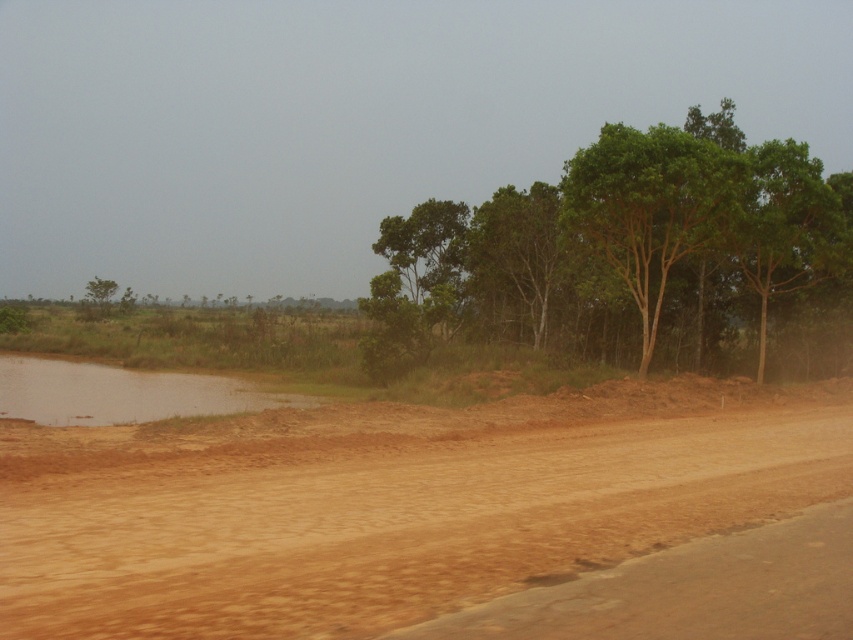
Question: Considering the real-world distances, which object is farthest from the green leafy trees at center?

Choices:
 (A) brown muddy water at lower left
 (B) green leafy tree at center
 (C) green leafy tree at right
 (D) green matte tree at upper left

Answer: (D)

Question: Which of the following is the closest to the observer?

Choices:
 (A) (764, 160)
 (B) (93, 280)

Answer: (A)

Question: Is green leafy tree at right further to camera compared to green leafy tree at center?

Choices:
 (A) no
 (B) yes

Answer: (A)

Question: Does green leafy tree at right appear on the right side of brown muddy water at lower left?

Choices:
 (A) no
 (B) yes

Answer: (B)

Question: Among these objects, which one is farthest from the camera?

Choices:
 (A) green leafy trees at center
 (B) green leafy tree at center
 (C) brown muddy water at lower left

Answer: (B)

Question: Observing the image, what is the correct spatial positioning of brown sandy dirt at lower left in reference to green leafy trees at center?

Choices:
 (A) left
 (B) right

Answer: (A)